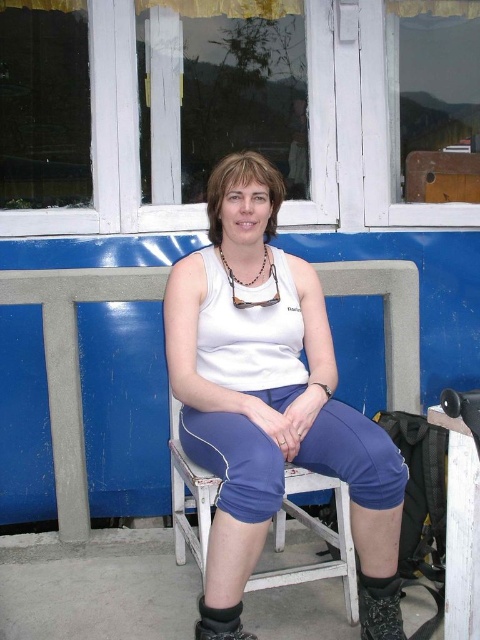
You are standing in front of the person sitting on the wooden chair. You want to place a small gift exactly at the point marked as point (199, 484). If the gift has a diameter of 1.5 feet, will it fit without overlapping the person?

The point (199, 484) is 5.74 feet away from the camera. Since the gift has a diameter of 1.5 feet, it can fit at that location without overlapping the person as there is sufficient space.

Looking at this image, you are standing at the point with coordinates point (240, 625) and want to walk to the point with coordinates point (230, 438). Given the scene described, which direction should you move relative to the window?

Since point (230, 438) is behind point (240, 625), you should move away from the window to reach it.

You are an assistant helping someone choose footwear. You see the black mesh boot at lower right and the black suede boot at lower center in the image. Which boot is located to the right of the other?

The black mesh boot at lower right is positioned on the right side of black suede boot at lower center.